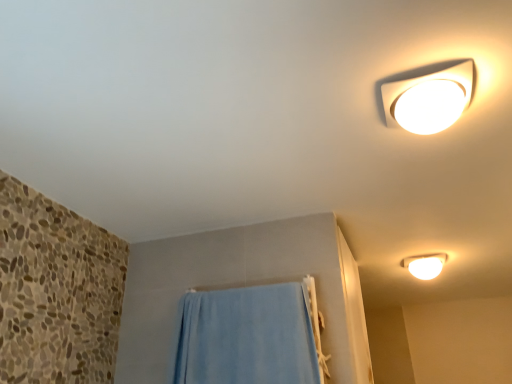
What do you see at coordinates (245, 337) in the screenshot? This screenshot has width=512, height=384. I see `blue fabric towel at lower center` at bounding box center [245, 337].

Identify the location of white glossy light fixture at upper right, marked as the 2th lamp in a top-to-bottom arrangement. (425, 265).

Looking at this image, is blue fabric towel at lower center directly adjacent to white glossy ceiling light at upper right, the second lamp from the right?

No.

How different are the orientations of blue fabric towel at lower center and white glossy ceiling light at upper right, which ranks as the second lamp in back-to-front order, in degrees?

They differ by 173 degrees in their facing directions.

Would you say blue fabric towel at lower center is to the left or to the right of white glossy ceiling light at upper right, which is the first lamp from front to back, in the picture?

Based on their positions, blue fabric towel at lower center is located to the left of white glossy ceiling light at upper right, which is the first lamp from front to back.

Considering the positions of point (175, 380) and point (475, 81), is point (175, 380) closer or farther from the camera than point (475, 81)?

Point (175, 380) is farther from the camera than point (475, 81).

Can you confirm if white glossy light fixture at upper right, marked as the 2th lamp in a top-to-bottom arrangement, is shorter than white glossy ceiling light at upper right, the second lamp from the right?

No, white glossy light fixture at upper right, marked as the 2th lamp in a top-to-bottom arrangement, is not shorter than white glossy ceiling light at upper right, the second lamp from the right.

Is there a large distance between white glossy light fixture at upper right, marked as the 2th lamp in a top-to-bottom arrangement, and white glossy ceiling light at upper right, which ranks as the second lamp in back-to-front order?

Yes, white glossy light fixture at upper right, marked as the 2th lamp in a top-to-bottom arrangement, is far from white glossy ceiling light at upper right, which ranks as the second lamp in back-to-front order.

Identify the location of lamp that appears in front of the white glossy light fixture at upper right, placed as the second lamp when sorted from left to right. (428, 96).

Considering the positions of objects white glossy light fixture at upper right, the second lamp from the front, and white glossy ceiling light at upper right, the second lamp from the right, in the image provided, who is more to the right, white glossy light fixture at upper right, the second lamp from the front, or white glossy ceiling light at upper right, the second lamp from the right,?

white glossy light fixture at upper right, the second lamp from the front, is more to the right.

From the image's perspective, between white glossy ceiling light at upper right, arranged as the 1th lamp when viewed from the left, and blue fabric towel at lower center, who is located below?

blue fabric towel at lower center, from the image's perspective.

Looking at this image, could you tell me if white glossy ceiling light at upper right, which ranks as the second lamp in back-to-front order, is facing blue fabric towel at lower center?

No, white glossy ceiling light at upper right, which ranks as the second lamp in back-to-front order, is not turned towards blue fabric towel at lower center.

How distant is white glossy ceiling light at upper right, the second lamp from the right, from blue fabric towel at lower center?

They are 33.97 inches apart.

From the image's perspective, which object appears higher, white glossy ceiling light at upper right, which ranks as the second lamp in back-to-front order, or white glossy light fixture at upper right, placed as the second lamp when sorted from left to right?

white glossy ceiling light at upper right, which ranks as the second lamp in back-to-front order, is shown above in the image.

Does white glossy ceiling light at upper right, which is the first lamp from front to back, have a greater height compared to white glossy light fixture at upper right, placed as the second lamp when sorted from left to right?

No.

The height and width of the screenshot is (384, 512). What are the coordinates of `lamp below the white glossy light fixture at upper right, which ranks as the 1th lamp in back-to-front order (from a real-world perspective)` in the screenshot? It's located at (428, 96).

From a real-world perspective, relative to blue fabric towel at lower center, is white glossy light fixture at upper right, arranged as the first lamp when ordered from the bottom, vertically above or below?

In terms of real-world spatial position, white glossy light fixture at upper right, arranged as the first lamp when ordered from the bottom, is above blue fabric towel at lower center.

Between point (428, 278) and point (209, 341), which one is positioned in front?

Positioned in front is point (209, 341).

Which of these two, white glossy light fixture at upper right, marked as the 2th lamp in a top-to-bottom arrangement, or blue fabric towel at lower center, is thinner?

With smaller width is blue fabric towel at lower center.

Considering the sizes of objects white glossy light fixture at upper right, arranged as the first lamp when ordered from the bottom, and blue fabric towel at lower center in the image provided, who is shorter, white glossy light fixture at upper right, arranged as the first lamp when ordered from the bottom, or blue fabric towel at lower center?

With less height is white glossy light fixture at upper right, arranged as the first lamp when ordered from the bottom.

Is point (198, 367) in front of point (438, 258)?

That is True.

Is blue fabric towel at lower center positioned with its back to white glossy light fixture at upper right, which ranks as the 1th lamp in back-to-front order?

No, blue fabric towel at lower center's orientation is not away from white glossy light fixture at upper right, which ranks as the 1th lamp in back-to-front order.

The width and height of the screenshot is (512, 384). Find the location of `lamp lying in front of the blue fabric towel at lower center`. lamp lying in front of the blue fabric towel at lower center is located at coordinates (428, 96).

This screenshot has height=384, width=512. I want to click on lamp above the white glossy light fixture at upper right, marked as the 2th lamp in a top-to-bottom arrangement (from the image's perspective), so click(428, 96).

Consider the image. Based on their spatial positions, is white glossy light fixture at upper right, marked as the 2th lamp in a top-to-bottom arrangement, or blue fabric towel at lower center further from white glossy ceiling light at upper right, arranged as the 1th lamp when viewed from the left?

The object further to white glossy ceiling light at upper right, arranged as the 1th lamp when viewed from the left, is white glossy light fixture at upper right, marked as the 2th lamp in a top-to-bottom arrangement.

When comparing their distances from white glossy light fixture at upper right, arranged as the first lamp when ordered from the bottom, does white glossy ceiling light at upper right, which is the first lamp from front to back, or blue fabric towel at lower center seem closer?

Among the two, blue fabric towel at lower center is located nearer to white glossy light fixture at upper right, arranged as the first lamp when ordered from the bottom.

Based on their spatial positions, is blue fabric towel at lower center or white glossy ceiling light at upper right, the 2th lamp positioned from the bottom, closer to white glossy light fixture at upper right, marked as the 2th lamp in a top-to-bottom arrangement?

The object closer to white glossy light fixture at upper right, marked as the 2th lamp in a top-to-bottom arrangement, is blue fabric towel at lower center.

Considering their positions, is white glossy ceiling light at upper right, which ranks as the 1th lamp in top-to-bottom order, positioned further to blue fabric towel at lower center than white glossy light fixture at upper right, the first lamp positioned from the right?

The object further to blue fabric towel at lower center is white glossy light fixture at upper right, the first lamp positioned from the right.

Considering their positions, is white glossy light fixture at upper right, the first lamp positioned from the right, positioned closer to blue fabric towel at lower center than white glossy ceiling light at upper right, which ranks as the 1th lamp in top-to-bottom order?

white glossy ceiling light at upper right, which ranks as the 1th lamp in top-to-bottom order.

From the picture: From the image, which object appears to be nearer to white glossy ceiling light at upper right, which ranks as the second lamp in back-to-front order, blue fabric towel at lower center or white glossy light fixture at upper right, placed as the second lamp when sorted from left to right?

blue fabric towel at lower center is closer to white glossy ceiling light at upper right, which ranks as the second lamp in back-to-front order.

At what (x,y) coordinates should I click in order to perform the action: click on curtain positioned between white glossy ceiling light at upper right, the second lamp from the right, and white glossy light fixture at upper right, which ranks as the 1th lamp in back-to-front order, from near to far. Please return your answer as a coordinate pair (x, y). Looking at the image, I should click on (245, 337).